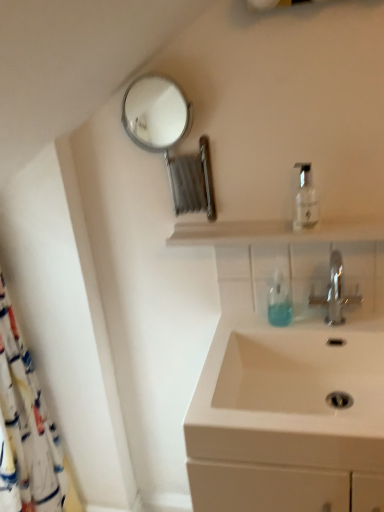
Question: In terms of size, does metallic circular mirror at upper left appear bigger or smaller than transparent glass shelf at center?

Choices:
 (A) big
 (B) small

Answer: (A)

Question: Is point (142, 87) positioned closer to the camera than point (201, 227)?

Choices:
 (A) closer
 (B) farther

Answer: (B)

Question: Estimate the real-world distances between objects in this image. Which object is farther from the metallic circular mirror at upper left?

Choices:
 (A) white fabric shower curtain at left
 (B) white ceramic sink at lower right
 (C) transparent glass shelf at center
 (D) clear plastic bottle at upper right
 (E) translucent plastic soap dispenser at center

Answer: (A)

Question: Which object is positioned farthest from the white ceramic sink at lower right?

Choices:
 (A) silver metallic faucet at center
 (B) translucent plastic soap dispenser at center
 (C) metallic circular mirror at upper left
 (D) transparent glass shelf at center
 (E) clear plastic bottle at upper right

Answer: (C)